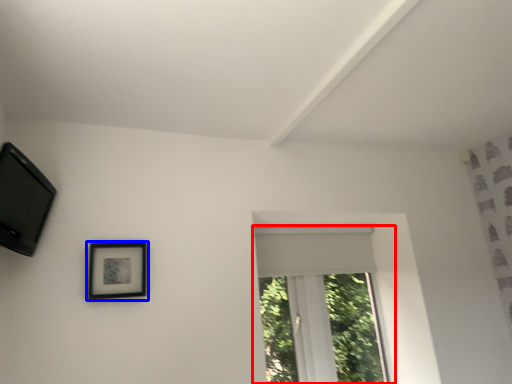
Question: Which point is further to the camera, window (highlighted by a red box) or picture frame (highlighted by a blue box)?

Choices:
 (A) window
 (B) picture frame

Answer: (A)